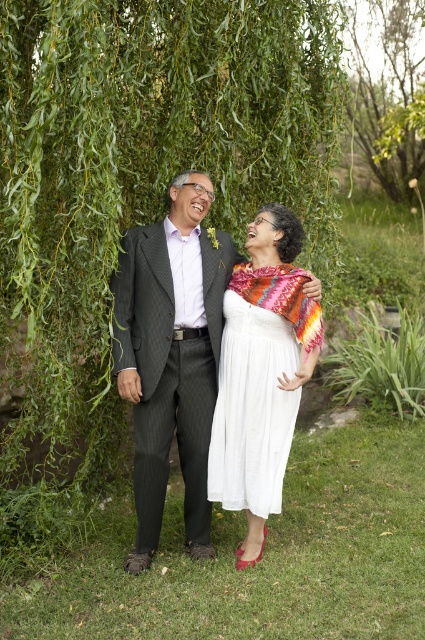
Is green leafy willow at upper left wider than multicolored woven shawl at center?

Indeed, green leafy willow at upper left has a greater width compared to multicolored woven shawl at center.

Identify the location of green leafy willow at upper left. (138, 177).

Between green leafy willow at upper left and white satin dress at center, which one appears on the right side from the viewer's perspective?

white satin dress at center is more to the right.

Which is in front, point (74, 321) or point (223, 305)?

Point (223, 305) is in front.

I want to click on green leafy willow at upper left, so click(138, 177).

Between point (220, 422) and point (410, 131), which one is positioned in front?

Point (220, 422) is more forward.

Does white satin dress at center have a lesser width compared to green leafy tree at upper center?

Yes, white satin dress at center is thinner than green leafy tree at upper center.

Identify the location of white satin dress at center. The image size is (425, 640). (252, 408).